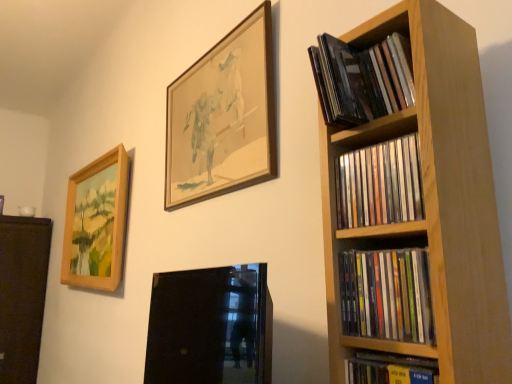
Question: In the image, is wooden picture frame at upper center, the first picture frame when ordered from right to left, positioned in front of or behind black glass picture frame at lower center, the third picture frame in the back-to-front sequence?

Choices:
 (A) front
 (B) behind

Answer: (B)

Question: From the image's perspective, relative to black glass picture frame at lower center, the third picture frame in the back-to-front sequence, is wooden picture frame at upper center, acting as the second picture frame starting from the back, above or below?

Choices:
 (A) below
 (B) above

Answer: (B)

Question: Based on their relative distances, which object is farther from the matte black cds at upper right, arranged as the first book when viewed from the top?

Choices:
 (A) wooden-framed painting at left, arranged as the first picture frame when viewed from the back
 (B) black glass picture frame at lower center, the third picture frame in the back-to-front sequence
 (C) hardcover book at lower right, the fourth book when ordered from top to bottom
 (D) matte plastic cds at right, the second book ordered from the bottom
 (E) wooden cd cases at right, the second book from the top

Answer: (B)

Question: Which object is the closest to the matte black cds at upper right, arranged as the first book when viewed from the top?

Choices:
 (A) black glass picture frame at lower center, the 2th picture frame in the right-to-left sequence
 (B) wooden cd cases at right, the 3th book ordered from the bottom
 (C) wooden picture frame at upper center, which is the 2th picture frame in front-to-back order
 (D) wooden-framed painting at left, the third picture frame positioned from the front
 (E) hardcover book at lower right, the fourth book when ordered from top to bottom

Answer: (B)